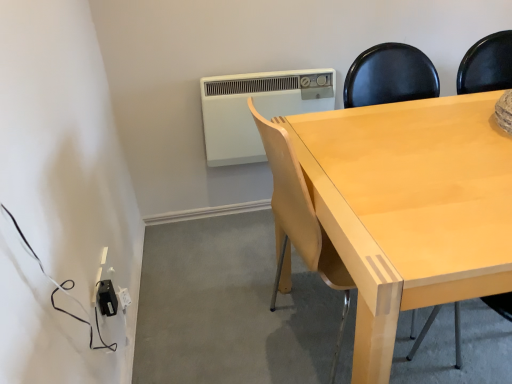
The image size is (512, 384). Find the location of `free space underneath white plastic air conditioner at upper center (from a real-world perspective)`. free space underneath white plastic air conditioner at upper center (from a real-world perspective) is located at coordinates (245, 217).